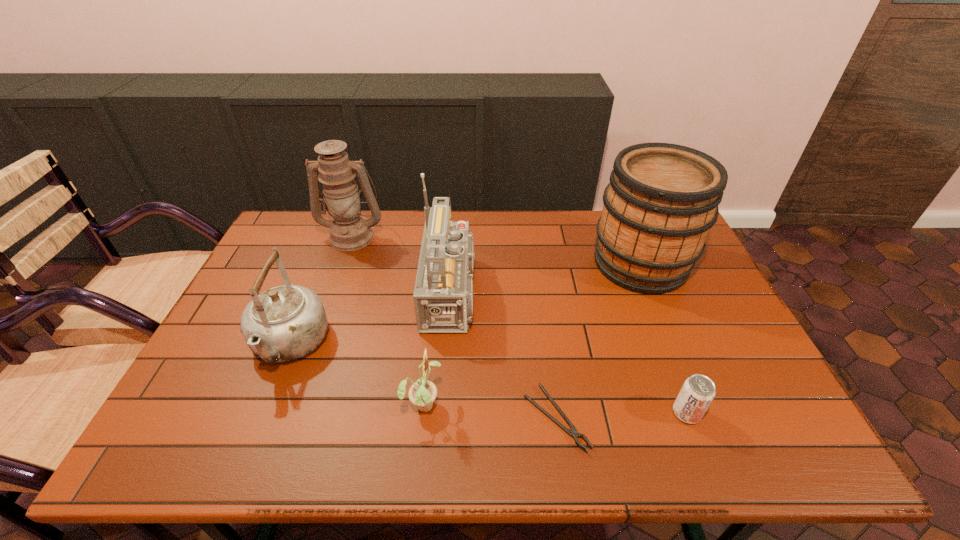
Identify the location of kettle that is at the left edge. The image size is (960, 540). coord(285,323).

Identify the location of object at the right edge. (662, 199).

Where is `object present at the far left corner`? The image size is (960, 540). object present at the far left corner is located at coordinates (349, 231).

The width and height of the screenshot is (960, 540). Identify the location of object located at the far right corner. (662, 199).

Identify the location of free space at the far edge of the desktop. (575, 215).

In the image, there is a desktop. Where is `free region at the near edge`? The image size is (960, 540). free region at the near edge is located at coordinates (454, 427).

Find the location of a particular element. This screenshot has height=540, width=960. vacant space at the left edge is located at coordinates (248, 393).

Where is `empty space between the third shortest object and the tongs`? The image size is (960, 540). empty space between the third shortest object and the tongs is located at coordinates (490, 410).

Locate an element on the screen. empty space between the radio receiver and the cider is located at coordinates (549, 278).

Locate an element on the screen. The image size is (960, 540). empty space between the radio receiver and the sunflower is located at coordinates (441, 348).